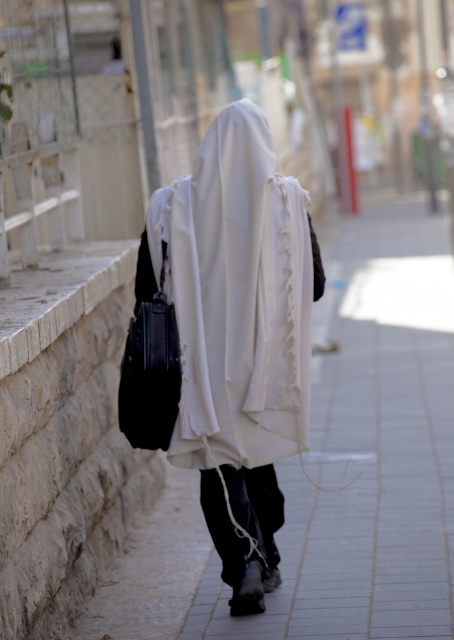
Question: Can you confirm if white fabric at center is positioned to the left of white fabric robe at center?

Choices:
 (A) yes
 (B) no

Answer: (B)

Question: Which object appears farthest from the camera in this image?

Choices:
 (A) white fabric robe at center
 (B) white fabric at center

Answer: (A)

Question: Can you confirm if white fabric at center is positioned to the right of white fabric robe at center?

Choices:
 (A) no
 (B) yes

Answer: (B)

Question: Which point is closer to the camera taking this photo?

Choices:
 (A) (252, 225)
 (B) (439, 600)

Answer: (A)

Question: Which point is closer to the camera?

Choices:
 (A) (332, 356)
 (B) (157, 195)

Answer: (B)

Question: Is white fabric at center to the left of white fabric robe at center from the viewer's perspective?

Choices:
 (A) yes
 (B) no

Answer: (B)